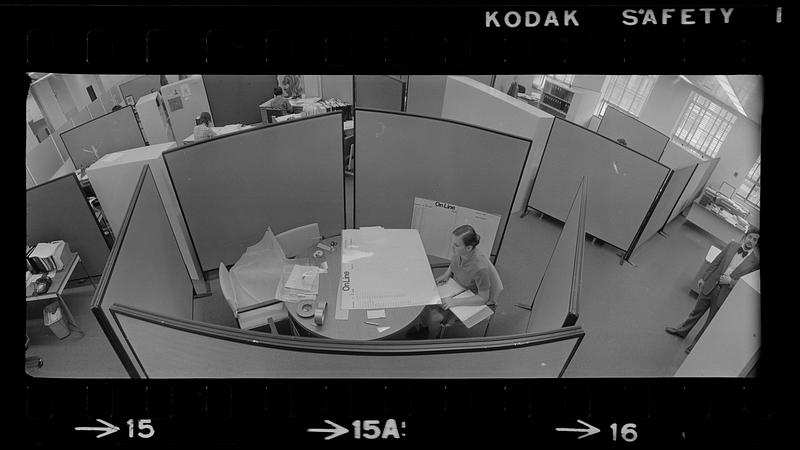
Where is `cubicle`? The image size is (800, 450). cubicle is located at coordinates (626, 190).